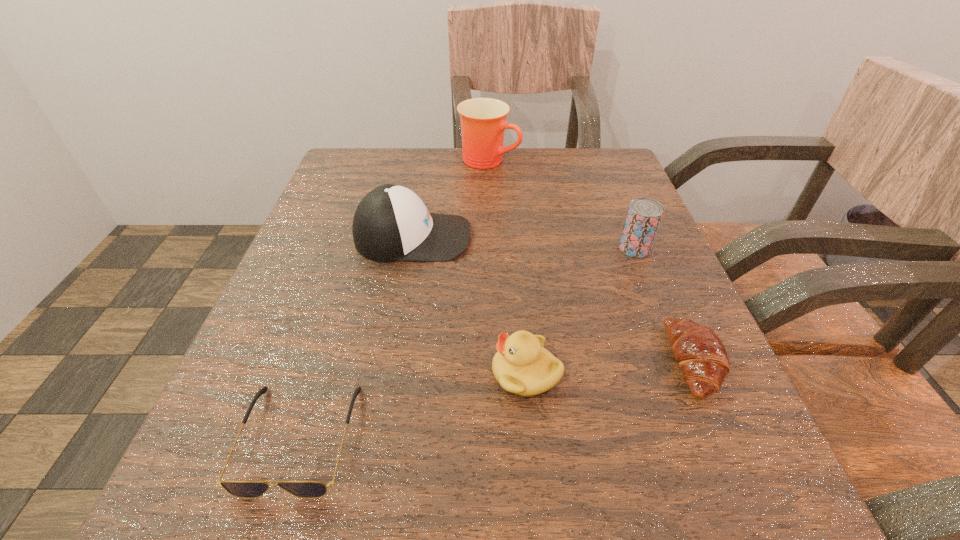
You are a GUI agent. You are given a task and a screenshot of the screen. Output one action in this format:
    pyautogui.click(x=<x>, y=<y>)
    Task: Click on the vacant space that's between the sunglasses and the cap
    
    Given the screenshot: What is the action you would take?
    pyautogui.click(x=356, y=338)

The height and width of the screenshot is (540, 960). Find the location of `vacant space that's between the fourth tallest object and the cup`. vacant space that's between the fourth tallest object and the cup is located at coordinates click(x=508, y=266).

The image size is (960, 540). In order to click on vacant area that lies between the farthest object and the sunglasses in this screenshot , I will do `click(394, 299)`.

Find the location of a particular element. Image resolution: width=960 pixels, height=540 pixels. vacant region between the third tallest object and the sunglasses is located at coordinates (467, 343).

Identify the location of free space between the cap and the crescent roll. The image size is (960, 540). (554, 299).

Find the location of `free area in between the crescent roll and the cup`. free area in between the crescent roll and the cup is located at coordinates (592, 261).

Identify the location of vacant area that lies between the farthest object and the sunglasses. (394, 299).

Find the location of a particular element. This screenshot has height=540, width=960. vacant area that lies between the sunglasses and the cap is located at coordinates (356, 338).

The image size is (960, 540). I want to click on free space between the cap and the sunglasses, so click(356, 338).

Locate which object ranks second in proximity to the fourth shortest object. Please provide its 2D coordinates. Your answer should be formatted as a tuple, i.e. [(x, y)], where the tuple contains the x and y coordinates of a point satisfying the conditions above.

[(522, 366)]